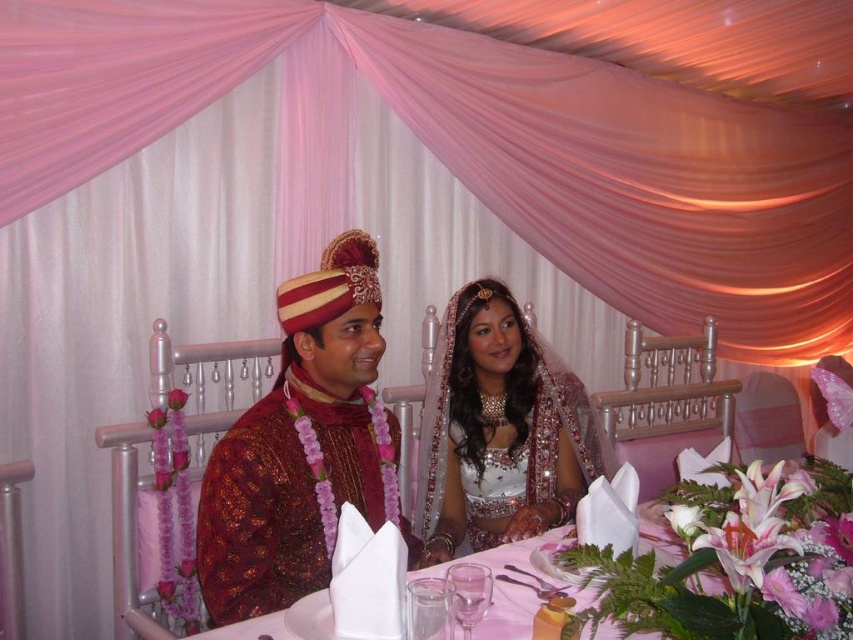
Based on the photo, does shiny silk turban at center appear under satin white blouse at center?

Yes.

Is point (254, 576) less distant than point (440, 406)?

That is True.

Describe the element at coordinates (303, 448) in the screenshot. The width and height of the screenshot is (853, 640). I see `shiny silk turban at center` at that location.

Where is `shiny silk turban at center`? The height and width of the screenshot is (640, 853). shiny silk turban at center is located at coordinates (303, 448).